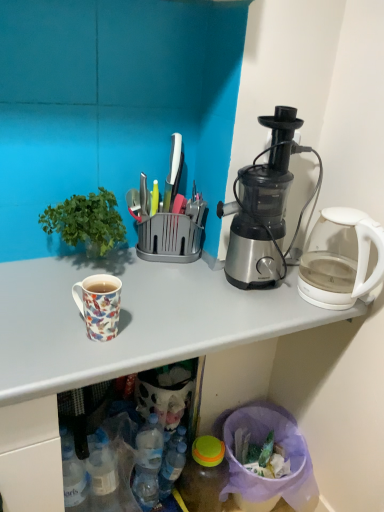
Measure the distance between point (217,482) and camera.

Point (217,482) and camera are 1.38 meters apart from each other.

Identify the location of white glossy mug at upper left. (185, 358).

Image resolution: width=384 pixels, height=512 pixels. Describe the element at coordinates (185, 358) in the screenshot. I see `white glossy mug at upper left` at that location.

Where is `translucent plastic bottle at lower center, the first bottle positioned from the left`? translucent plastic bottle at lower center, the first bottle positioned from the left is located at coordinates (172, 462).

This screenshot has height=512, width=384. What are the coordinates of `transparent glass kettle at right` in the screenshot? It's located at (341, 260).

Image resolution: width=384 pixels, height=512 pixels. What do you see at coordinates (341, 260) in the screenshot?
I see `transparent glass kettle at right` at bounding box center [341, 260].

The image size is (384, 512). In order to click on green leafy plant at left in this screenshot , I will do pyautogui.click(x=86, y=222).

Locate an element on the screen. Image resolution: width=384 pixels, height=512 pixels. translucent plastic bottle at lower center, which is the 2th bottle in left-to-right order is located at coordinates (203, 481).

Consider the image. From the image's perspective, is satin silver blender at right below translucent plastic bottle at lower center, the first bottle in the right-to-left sequence?

No, from the image's perspective, satin silver blender at right is not beneath translucent plastic bottle at lower center, the first bottle in the right-to-left sequence.

Is satin silver blender at right not near translucent plastic bottle at lower center, the first bottle in the right-to-left sequence?

No, satin silver blender at right is not far away from translucent plastic bottle at lower center, the first bottle in the right-to-left sequence.

Which is closer to the camera, (x=244, y=174) or (x=204, y=500)?

Point (x=244, y=174).

Image resolution: width=384 pixels, height=512 pixels. Find the location of `blender that appears on the right of translucent plastic bottle at lower center, which is the 2th bottle in left-to-right order`. blender that appears on the right of translucent plastic bottle at lower center, which is the 2th bottle in left-to-right order is located at coordinates pos(264,207).

Considering the positions of objects green leafy plant at left and translucent plastic bottle at lower center, acting as the second bottle starting from the right, in the image provided, who is in front, green leafy plant at left or translucent plastic bottle at lower center, acting as the second bottle starting from the right,?

green leafy plant at left is closer to the camera.

Can we say green leafy plant at left lies outside translucent plastic bottle at lower center, acting as the second bottle starting from the right?

Absolutely, green leafy plant at left is external to translucent plastic bottle at lower center, acting as the second bottle starting from the right.

From a real-world perspective, is green leafy plant at left positioned above or below translucent plastic bottle at lower center, acting as the second bottle starting from the right?

green leafy plant at left is situated higher than translucent plastic bottle at lower center, acting as the second bottle starting from the right, in the real world.

Is green leafy plant at left far from translucent plastic bottle at lower center, acting as the second bottle starting from the right?

green leafy plant at left is actually quite close to translucent plastic bottle at lower center, acting as the second bottle starting from the right.

From a real-world perspective, is translucent plastic bottle at lower center, the first bottle in the right-to-left sequence, above or below white glossy mug at upper left?

translucent plastic bottle at lower center, the first bottle in the right-to-left sequence, is below white glossy mug at upper left.

From the image's perspective, does translucent plastic bottle at lower center, which is the 2th bottle in left-to-right order, appear higher than white glossy mug at upper left?

Incorrect, from the image's perspective, translucent plastic bottle at lower center, which is the 2th bottle in left-to-right order, is lower than white glossy mug at upper left.

From the white glossy mug at upper left, count 1st bottles backward and point to it. Please provide its 2D coordinates.

[(203, 481)]

Could you tell me if white glossy mug at upper left is turned towards translucent plastic bottle at lower center, the first bottle positioned from the left?

Yes, white glossy mug at upper left is oriented towards translucent plastic bottle at lower center, the first bottle positioned from the left.

Is the position of white glossy mug at upper left less distant than that of translucent plastic bottle at lower center, the first bottle positioned from the left?

That is True.

Is white glossy mug at upper left not close to translucent plastic bottle at lower center, the first bottle positioned from the left?

That's not correct — white glossy mug at upper left is a little close to translucent plastic bottle at lower center, the first bottle positioned from the left.

From a real-world perspective, is white glossy mug at upper left on top of translucent plastic bottle at lower center, the first bottle positioned from the left?

Yes.

In the scene shown: Between translucent plastic bottle at lower center, which is the 2th bottle in left-to-right order, and transparent glass kettle at right, which one has smaller width?

translucent plastic bottle at lower center, which is the 2th bottle in left-to-right order, is thinner.

In the scene shown: Which is more to the left, translucent plastic bottle at lower center, the first bottle in the right-to-left sequence, or transparent glass kettle at right?

translucent plastic bottle at lower center, the first bottle in the right-to-left sequence, is more to the left.

Measure the distance from translucent plastic bottle at lower center, which is the 2th bottle in left-to-right order, to transparent glass kettle at right.

translucent plastic bottle at lower center, which is the 2th bottle in left-to-right order, and transparent glass kettle at right are 29.52 inches apart.

Which is in front, point (211, 490) or point (339, 283)?

The point (339, 283) is closer.

Could you measure the distance between translucent plastic bottle at lower center, the first bottle in the right-to-left sequence, and floral ceramic mug at left?

translucent plastic bottle at lower center, the first bottle in the right-to-left sequence, and floral ceramic mug at left are 30.98 inches apart from each other.

Considering the positions of point (212, 499) and point (100, 305), is point (212, 499) closer or farther from the camera than point (100, 305)?

Point (212, 499) is positioned farther from the camera compared to point (100, 305).

Is translucent plastic bottle at lower center, which is the 2th bottle in left-to-right order, not close to floral ceramic mug at left?

No, translucent plastic bottle at lower center, which is the 2th bottle in left-to-right order, is not far away from floral ceramic mug at left.

Which object is more forward, translucent plastic bottle at lower center, which is the 2th bottle in left-to-right order, or floral ceramic mug at left?

Positioned in front is floral ceramic mug at left.

In the scene shown: Which is more distant, (323, 298) or (137, 278)?

The point (137, 278) is more distant.

Looking at this image, is transparent glass kettle at right not near white glossy mug at upper left?

No, there isn't a large distance between transparent glass kettle at right and white glossy mug at upper left.

How different are the orientations of transparent glass kettle at right and white glossy mug at upper left in degrees?

transparent glass kettle at right and white glossy mug at upper left are facing 4.73 degrees away from each other.

Considering their positions, is transparent glass kettle at right located in front of or behind white glossy mug at upper left?

transparent glass kettle at right is positioned farther from the viewer than white glossy mug at upper left.

From the image's perspective, count 2nd bottles downward from the satin silver blender at right and point to it. Please provide its 2D coordinates.

[(203, 481)]

Identify the location of houseplant above the translucent plastic bottle at lower center, acting as the second bottle starting from the right (from a real-world perspective). (86, 222).

Considering their positions, is white glossy mug at upper left positioned further to translucent plastic bottle at lower center, the first bottle in the right-to-left sequence, than green leafy plant at left?

Among the two, green leafy plant at left is located further to translucent plastic bottle at lower center, the first bottle in the right-to-left sequence.

From the image, which object appears to be nearer to green leafy plant at left, transparent glass kettle at right or satin silver blender at right?

satin silver blender at right is positioned closer to the anchor green leafy plant at left.

Considering their positions, is floral ceramic mug at left positioned further to green leafy plant at left than translucent plastic bottle at lower center, which is the 2th bottle in left-to-right order?

translucent plastic bottle at lower center, which is the 2th bottle in left-to-right order, is positioned further to the anchor green leafy plant at left.

When comparing their distances from floral ceramic mug at left, does translucent plastic bottle at lower center, which is the 2th bottle in left-to-right order, or satin silver blender at right seem further?

translucent plastic bottle at lower center, which is the 2th bottle in left-to-right order.

From the image, which object appears to be nearer to translucent plastic bottle at lower center, which is the 2th bottle in left-to-right order, satin silver blender at right or floral ceramic mug at left?

floral ceramic mug at left is positioned closer to the anchor translucent plastic bottle at lower center, which is the 2th bottle in left-to-right order.

Based on their spatial positions, is green leafy plant at left or translucent plastic bottle at lower center, which is the 2th bottle in left-to-right order, further from floral ceramic mug at left?

Among the two, translucent plastic bottle at lower center, which is the 2th bottle in left-to-right order, is located further to floral ceramic mug at left.

Which object lies nearer to the anchor point floral ceramic mug at left, translucent plastic bottle at lower center, the first bottle positioned from the left, or green leafy plant at left?

green leafy plant at left.

Looking at the image, which one is located further to white glossy mug at upper left, translucent plastic bottle at lower center, which is the 2th bottle in left-to-right order, or green leafy plant at left?

Among the two, translucent plastic bottle at lower center, which is the 2th bottle in left-to-right order, is located further to white glossy mug at upper left.

I want to click on desk that lies between floral ceramic mug at left and translucent plastic bottle at lower center, which is the 2th bottle in left-to-right order, from top to bottom, so click(185, 358).

The image size is (384, 512). What are the coordinates of `coffee cup that lies between transparent glass kettle at right and translucent plastic bottle at lower center, the first bottle positioned from the left, from top to bottom` in the screenshot? It's located at (99, 305).

The width and height of the screenshot is (384, 512). I want to click on bottle between transparent glass kettle at right and translucent plastic bottle at lower center, the first bottle in the right-to-left sequence, in the vertical direction, so click(172, 462).

Where is `bottle between white glossy mug at upper left and translucent plastic bottle at lower center, acting as the second bottle starting from the right, from front to back`? bottle between white glossy mug at upper left and translucent plastic bottle at lower center, acting as the second bottle starting from the right, from front to back is located at coordinates click(203, 481).